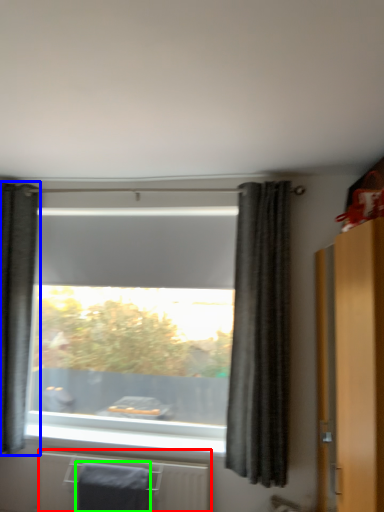
Question: Considering the real-world distances, which object is closest to radiator (highlighted by a red box)? curtain (highlighted by a blue box) or bath towel (highlighted by a green box).

Choices:
 (A) curtain
 (B) bath towel

Answer: (B)